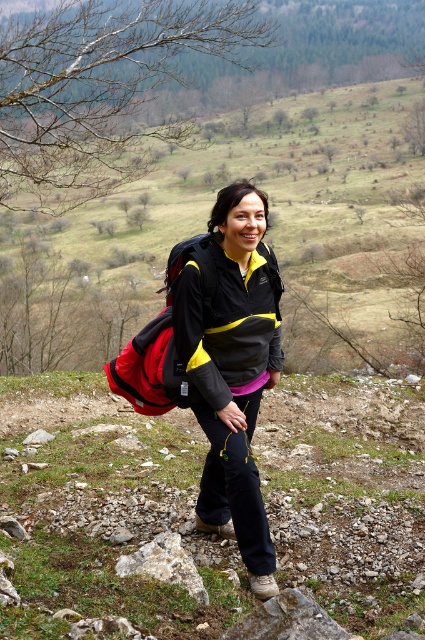
You are a hiker trying to navigate through the rugged terrain. You see two points marked on your map. The first point is at coordinate point (198, 332) and the second is at point (178, 554). Which point is closer to your current position if you are facing the direction of the path?

Point (198, 332) is in front of point (178, 554), so the first point is closer to your current position when facing the path direction.